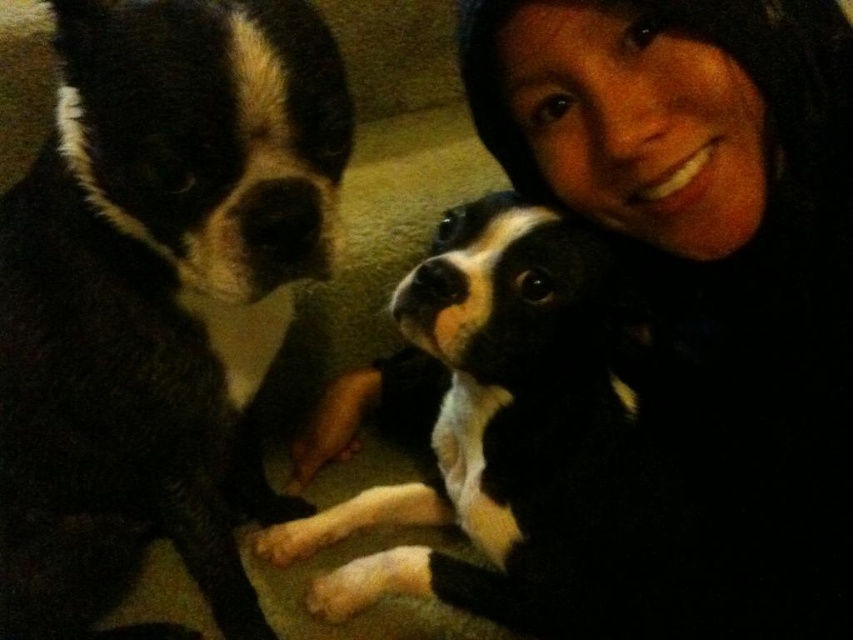
Can you confirm if black fur dog at left is bigger than black and white fur at center?

Indeed, black fur dog at left has a larger size compared to black and white fur at center.

Who is more distant from viewer, (44, 477) or (590, 364)?

Point (44, 477)

You are a GUI agent. You are given a task and a screenshot of the screen. Output one action in this format:
    pyautogui.click(x=<x>, y=<y>)
    Task: Click on the black fur dog at left
    This screenshot has height=640, width=853.
    Given the screenshot: What is the action you would take?
    pyautogui.click(x=157, y=292)